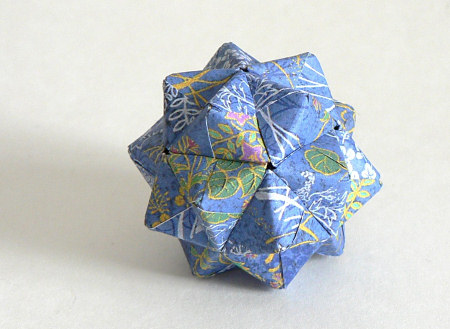
The height and width of the screenshot is (329, 450). I want to click on wall, so click(392, 169).